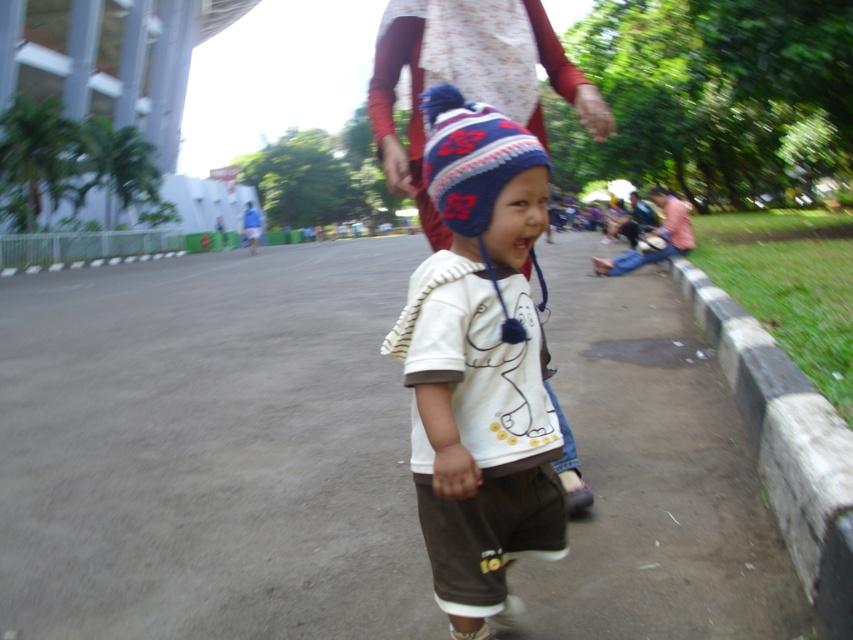
Is white soft t-shirt at center wider than knitted woolen hat at center?

Indeed, white soft t-shirt at center has a greater width compared to knitted woolen hat at center.

Is white soft t-shirt at center above knitted woolen hat at center?

No.

Which is in front, point (415, 369) or point (492, 161)?

Positioned in front is point (492, 161).

Image resolution: width=853 pixels, height=640 pixels. In order to click on white soft t-shirt at center in this screenshot , I will do `click(479, 365)`.

Is the position of black concrete curb at lower right more distant than that of knitted woolen hat at center?

Yes, it is.

Between black concrete curb at lower right and knitted woolen hat at center, which one appears on the left side from the viewer's perspective?

Positioned to the left is knitted woolen hat at center.

You are a GUI agent. You are given a task and a screenshot of the screen. Output one action in this format:
    pyautogui.click(x=<x>, y=<y>)
    Task: Click on the black concrete curb at lower right
    The image size is (853, 640).
    Given the screenshot: What is the action you would take?
    pyautogui.click(x=787, y=445)

Find the location of `black concrete curb at lower right`. black concrete curb at lower right is located at coordinates (787, 445).

What do you see at coordinates (479, 365) in the screenshot? I see `white soft t-shirt at center` at bounding box center [479, 365].

Which is more to the right, white soft t-shirt at center or black concrete curb at lower right?

Positioned to the right is black concrete curb at lower right.

Does point (468, 314) come in front of point (825, 452)?

Yes, point (468, 314) is closer to viewer.

You are a GUI agent. You are given a task and a screenshot of the screen. Output one action in this format:
    pyautogui.click(x=<x>, y=<y>)
    Task: Click on the white soft t-shirt at center
    This screenshot has height=640, width=853.
    Given the screenshot: What is the action you would take?
    tap(479, 365)